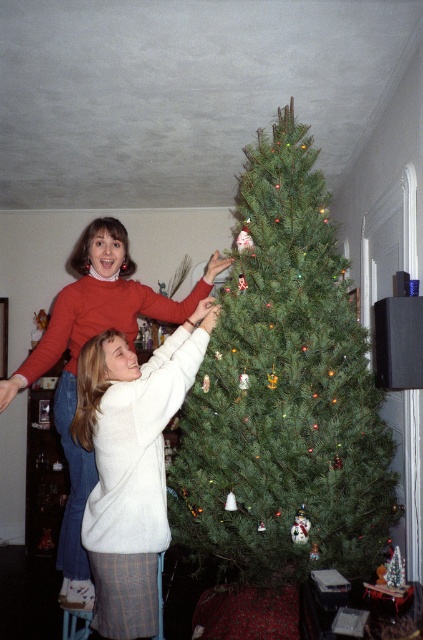
Who is higher up, green matte christmas tree at center or matte red sweater at upper left?

green matte christmas tree at center is higher up.

Can you confirm if green matte christmas tree at center is positioned to the right of matte red sweater at upper left?

Indeed, green matte christmas tree at center is positioned on the right side of matte red sweater at upper left.

Image resolution: width=423 pixels, height=640 pixels. Find the location of `green matte christmas tree at center`. green matte christmas tree at center is located at coordinates (285, 392).